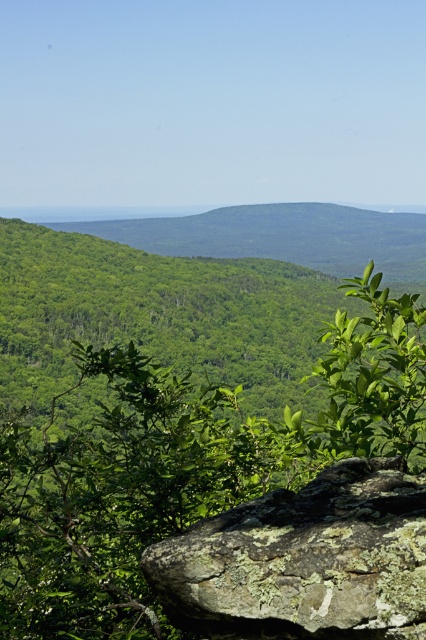
You are standing in the forest and see the point marked at coordinates (166, 412). What is the most likely object located at that point?

The point at coordinates (166, 412) is most likely the location of the green leafy tree at center.